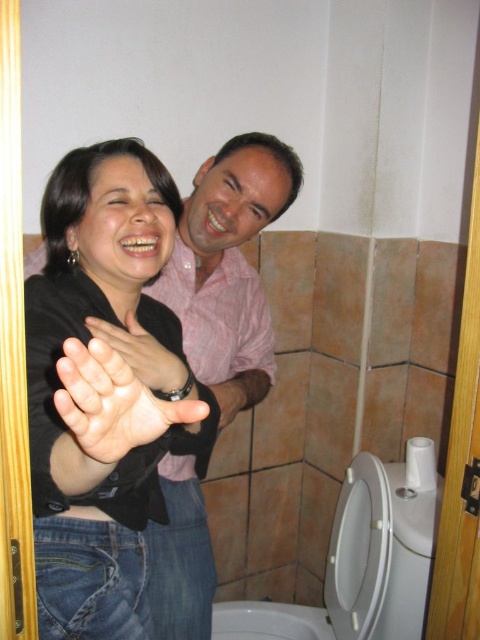
Question: Does white glossy toilet bowl at lower right have a greater width compared to white glossy toilet bowl at lower center?

Choices:
 (A) no
 (B) yes

Answer: (B)

Question: Which of the following is the closest to the observer?

Choices:
 (A) black matte shirt at center
 (B) white glossy toilet bowl at lower center

Answer: (A)

Question: Which object is positioned farthest from the pink cotton shirt at upper center?

Choices:
 (A) white glossy toilet bowl at lower center
 (B) matte black hand at center

Answer: (A)

Question: Estimate the real-world distances between objects in this image. Which object is farther from the matte black hand at center?

Choices:
 (A) white glossy toilet bowl at lower center
 (B) smooth skin hand at center
 (C) black matte shirt at center

Answer: (A)

Question: Is white glossy toilet bowl at lower center to the right of matte black hand at center from the viewer's perspective?

Choices:
 (A) yes
 (B) no

Answer: (A)

Question: Does white glossy toilet bowl at lower right appear on the right side of smooth skin hand at center?

Choices:
 (A) yes
 (B) no

Answer: (A)